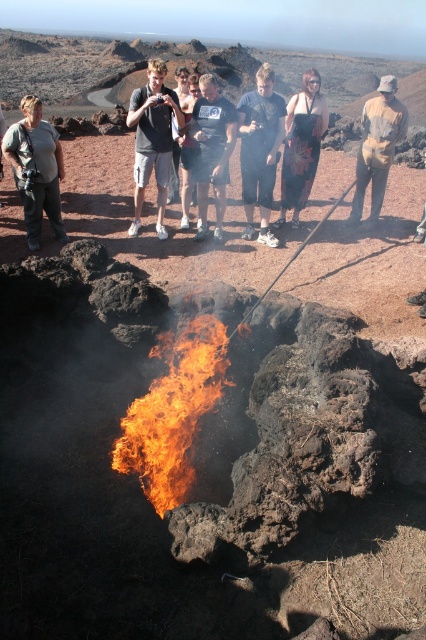
Is flameorange/redflame at center closer to camera compared to floral skirt at center?

That is True.

Does flameorange/redflame at center have a lesser height compared to floral skirt at center?

Indeed, flameorange/redflame at center has a lesser height compared to floral skirt at center.

Where is `flameorange/redflame at center`? Image resolution: width=426 pixels, height=640 pixels. flameorange/redflame at center is located at coordinates (172, 412).

Can you confirm if flameorange/redflame at center is bigger than brown leather jacket at right?

Incorrect, flameorange/redflame at center is not larger than brown leather jacket at right.

Locate an element on the screen. This screenshot has width=426, height=640. flameorange/redflame at center is located at coordinates coord(172,412).

Between matte gray shirt at center and dark gray t-shirt at center, which one is positioned lower?

matte gray shirt at center is below.

At what (x,y) coordinates should I click in order to perform the action: click on matte gray shirt at center. Please return your answer as a coordinate pair (x, y). This screenshot has width=426, height=640. Looking at the image, I should click on (36, 170).

Identify the location of matte gray shirt at center. The image size is (426, 640). (36, 170).